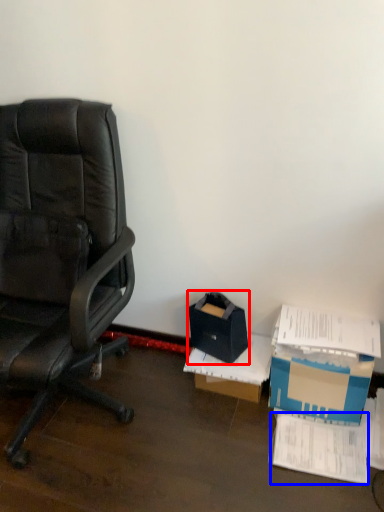
Question: Which point is further to the camera, storage box (highlighted by a red box) or paperback book (highlighted by a blue box)?

Choices:
 (A) storage box
 (B) paperback book

Answer: (A)